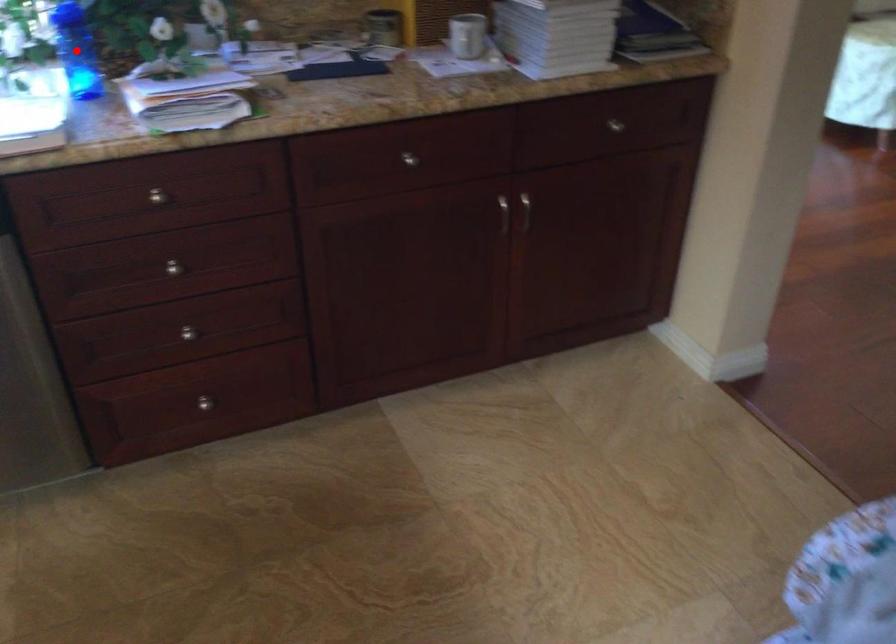
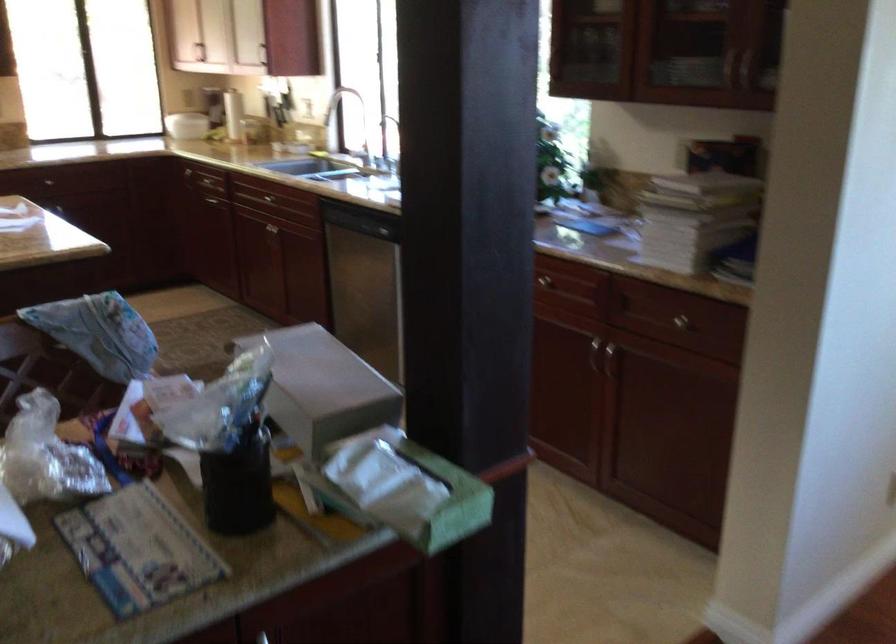
Question: I am providing you with two images of the same scene from different viewpoints. A red point is marked on the first image. At the location where the point appears in image 1, is it still visible in image 2?

Choices:
 (A) Yes
 (B) No

Answer: (B)